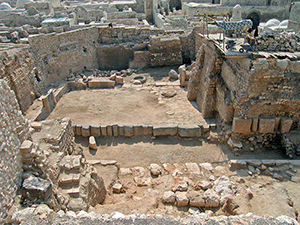
This screenshot has width=300, height=225. In order to click on windows in this screenshot , I will do `click(35, 74)`, `click(84, 48)`.